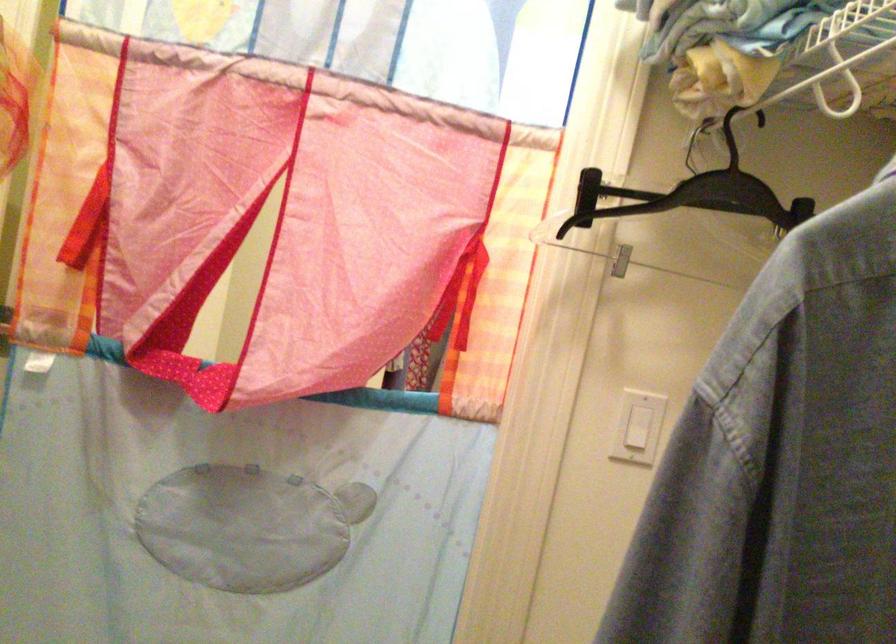
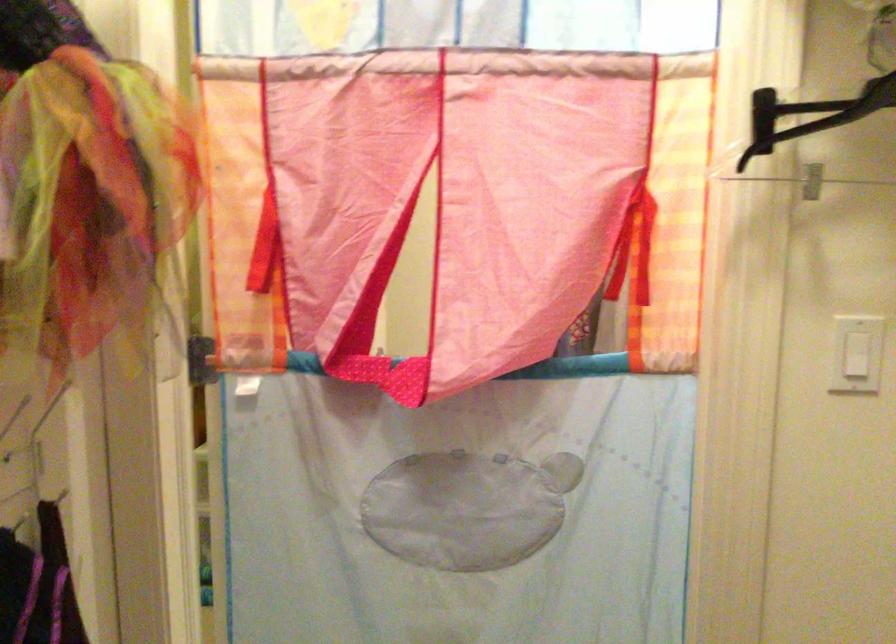
Question: The camera is either moving clockwise (left) or counter-clockwise (right) around the object. The first image is from the beginning of the video and the second image is from the end. Is the camera moving left or right when shooting the video?

Choices:
 (A) Left
 (B) Right

Answer: (B)